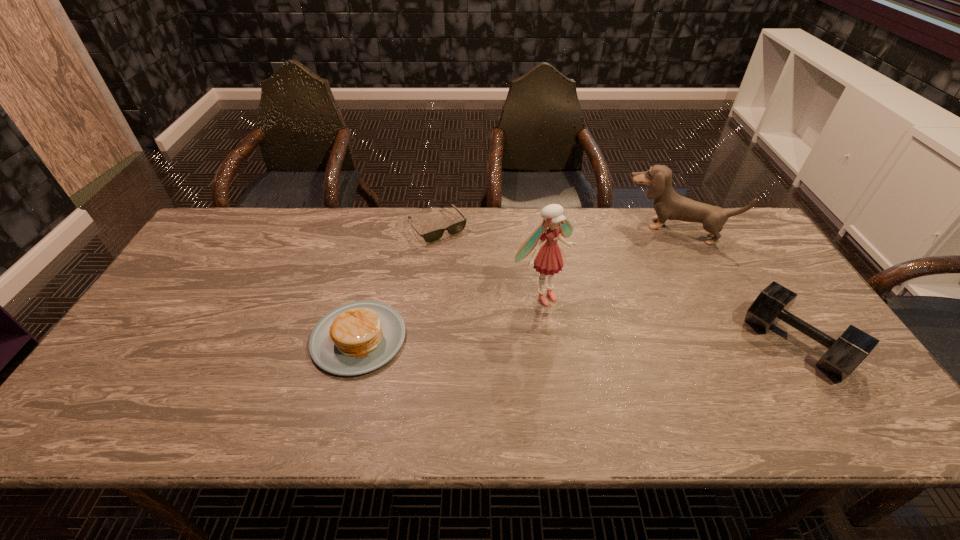
Identify the location of dumbbell present at the near edge. (843, 356).

In order to click on dumbbell located in the right edge section of the desktop in this screenshot , I will do `click(843, 356)`.

You are a GUI agent. You are given a task and a screenshot of the screen. Output one action in this format:
    pyautogui.click(x=<x>, y=<y>)
    Task: Click on the puppy situated at the right edge
    
    Given the screenshot: What is the action you would take?
    pyautogui.click(x=668, y=205)

Find the location of `object that is at the far right corner`. object that is at the far right corner is located at coordinates coord(668,205).

I want to click on object present at the near right corner, so click(843, 356).

The width and height of the screenshot is (960, 540). I want to click on free region at the far edge of the desktop, so click(x=436, y=253).

The width and height of the screenshot is (960, 540). I want to click on vacant region at the near edge of the desktop, so click(x=735, y=395).

Identify the location of free spot at the right edge of the desktop. The width and height of the screenshot is (960, 540). (747, 290).

Locate an element on the screen. The width and height of the screenshot is (960, 540). free spot at the far right corner of the desktop is located at coordinates (726, 240).

Identify the location of free area in between the fourth tallest object and the third shortest object. (577, 341).